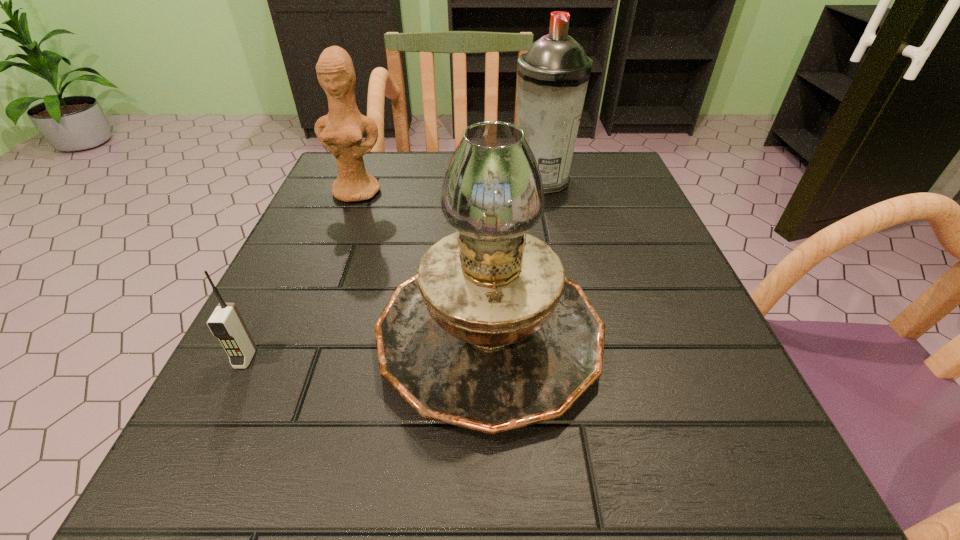
Find the location of a particular element. The image size is (960, 540). aerosol can is located at coordinates (553, 75).

Identify the location of oil lamp. This screenshot has height=540, width=960. [490, 335].

Where is `figurine`? figurine is located at coordinates (x=340, y=131).

Locate an element on the screen. cellular telephone is located at coordinates (226, 323).

The height and width of the screenshot is (540, 960). I want to click on vacant space located 0.060m on the back of the aerosol can, so click(x=538, y=153).

The width and height of the screenshot is (960, 540). Identify the location of vacant space located 0.080m on the left of the oil lamp. (325, 331).

Locate an element on the screen. vacant area situated on the front-facing side of the figurine is located at coordinates (313, 308).

The image size is (960, 540). What are the coordinates of `free space located on the front-facing side of the cellular telephone` in the screenshot? It's located at 169,514.

The width and height of the screenshot is (960, 540). What are the coordinates of `aerosol can that is at the far edge` in the screenshot? It's located at (553, 75).

You are a GUI agent. You are given a task and a screenshot of the screen. Output one action in this format:
    pyautogui.click(x=<x>, y=<y>)
    Task: Click on the figurine situated at the far edge
    
    Given the screenshot: What is the action you would take?
    pyautogui.click(x=340, y=131)